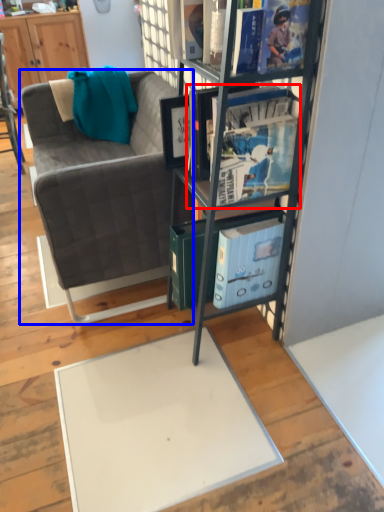
Question: Among these objects, which one is farthest to the camera, book (highlighted by a red box) or studio couch (highlighted by a blue box)?

Choices:
 (A) book
 (B) studio couch

Answer: (B)